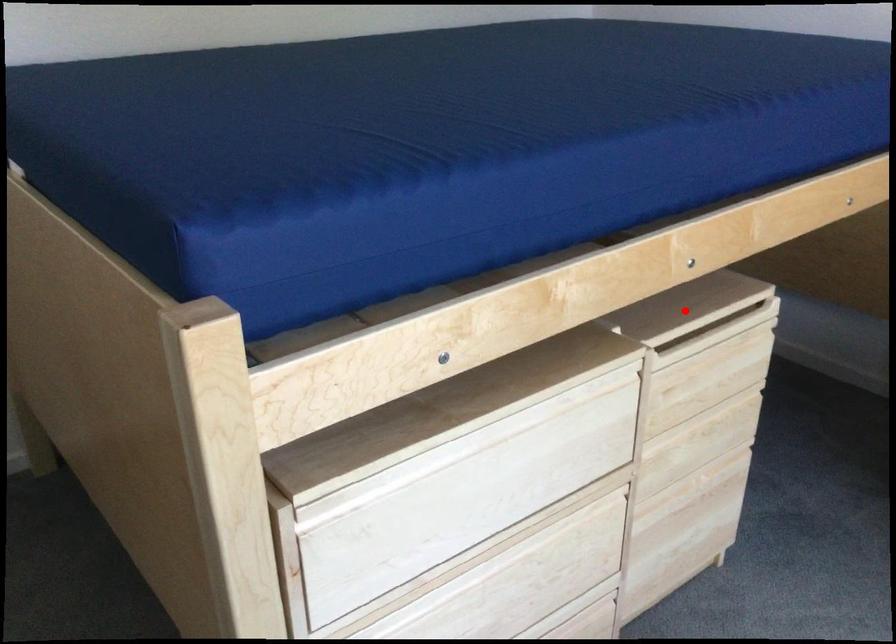
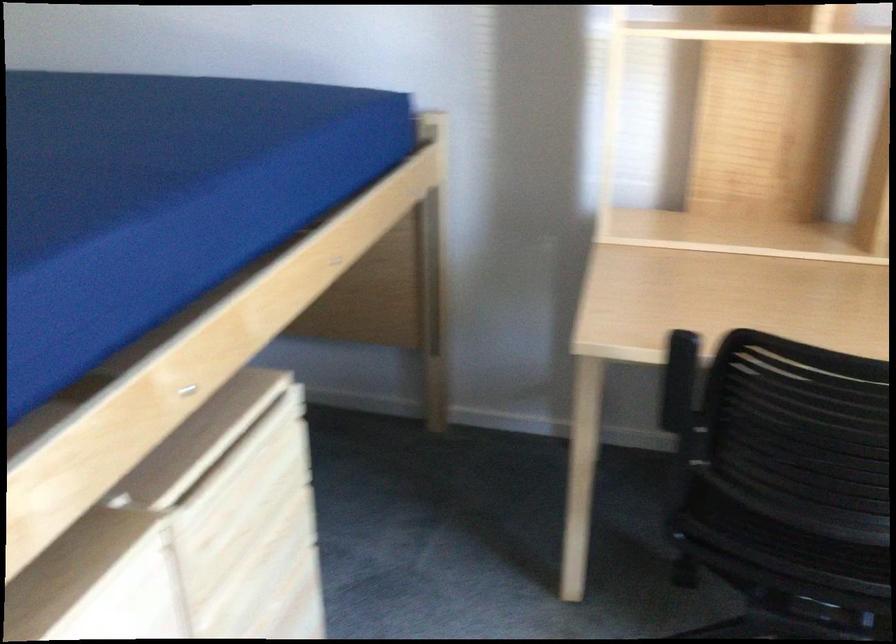
Find the pixel in the second image that matches the highlighted location in the first image.

(202, 439)